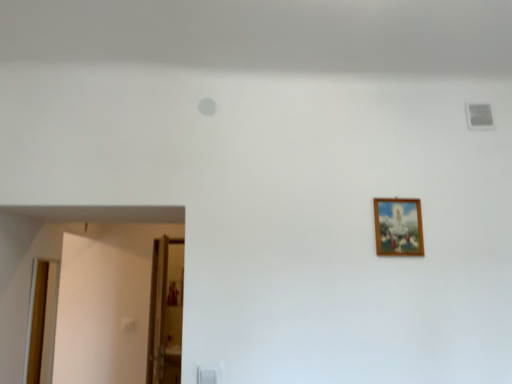
Question: From a real-world perspective, relative to wooden door at left, the 1th door in the left-to-right sequence, is wooden frame at upper right vertically above or below?

Choices:
 (A) above
 (B) below

Answer: (A)

Question: Relative to wooden door at left, which is the 2th door in right-to-left order, is wooden frame at upper right in front or behind?

Choices:
 (A) front
 (B) behind

Answer: (A)

Question: Which of these objects is positioned closest to the wooden door at lower left, the second door when ordered from left to right?

Choices:
 (A) wooden door at left, which is the 2th door in right-to-left order
 (B) transparent glass door at lower left
 (C) wooden frame at upper right

Answer: (B)

Question: Based on their relative distances, which object is nearer to the transparent glass door at lower left?

Choices:
 (A) wooden door at left, the 1th door in the left-to-right sequence
 (B) wooden door at lower left, the second door when ordered from left to right
 (C) wooden frame at upper right

Answer: (B)